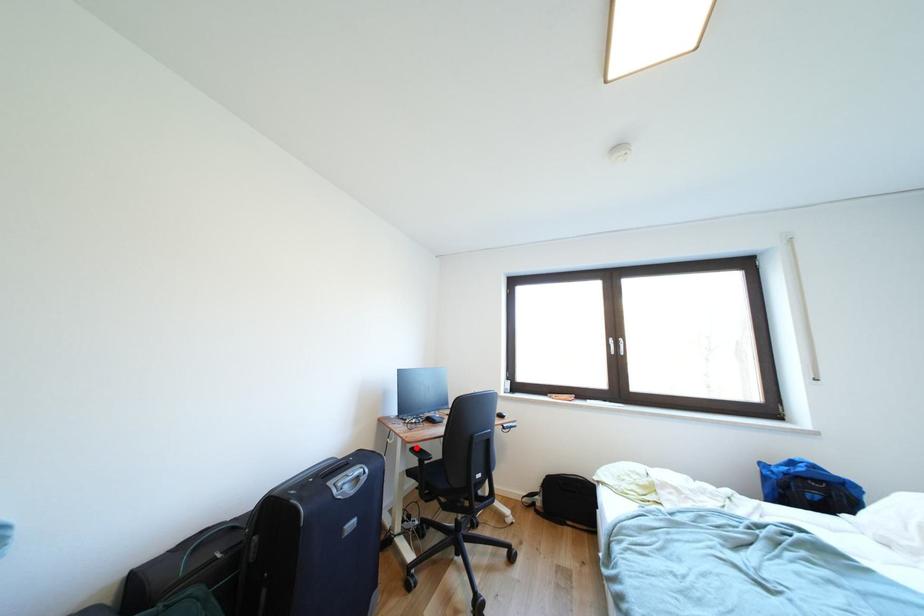
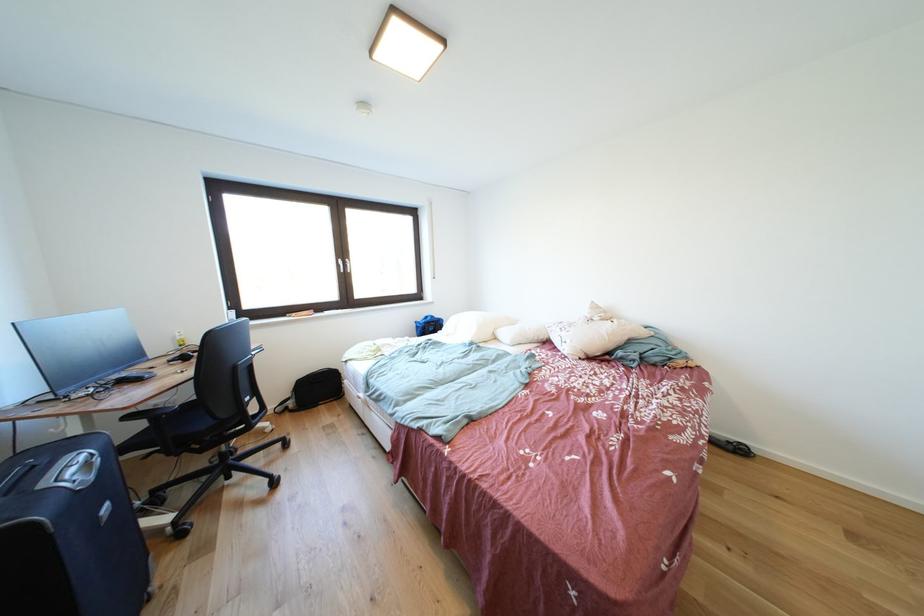
Find the pixel in the second image that matches the highlighted location in the first image.

(134, 413)